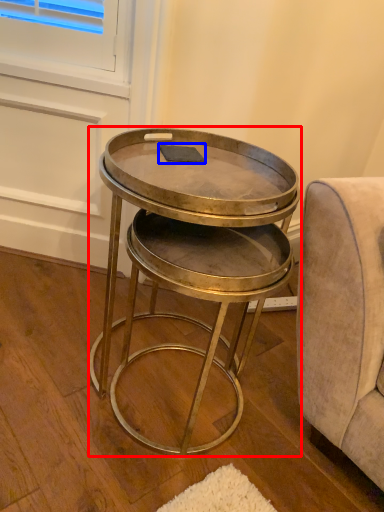
Question: Which of the following is the closest to the observer, table (highlighted by a red box) or pad (highlighted by a blue box)?

Choices:
 (A) table
 (B) pad

Answer: (A)